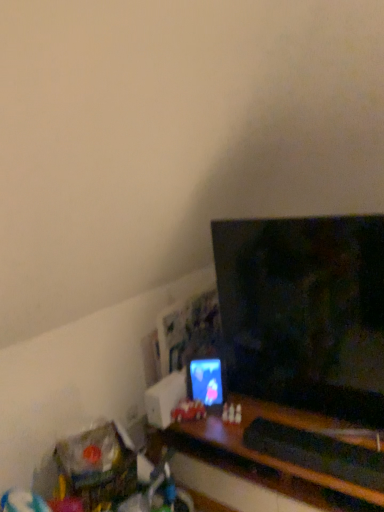
Question: Is black glossy tv at center inside the boundaries of translucent plastic toy at center, or outside?

Choices:
 (A) outside
 (B) inside

Answer: (A)

Question: Relative to translucent plastic toy at center, is black glossy tv at center in front or behind?

Choices:
 (A) front
 (B) behind

Answer: (A)

Question: Which of these objects is positioned farthest from the matte plastic phone at center?

Choices:
 (A) black glossy tv at center
 (B) translucent plastic toy at center

Answer: (A)

Question: Which of these objects is positioned closest to the matte plastic phone at center?

Choices:
 (A) translucent plastic toy at center
 (B) black glossy tv at center

Answer: (A)